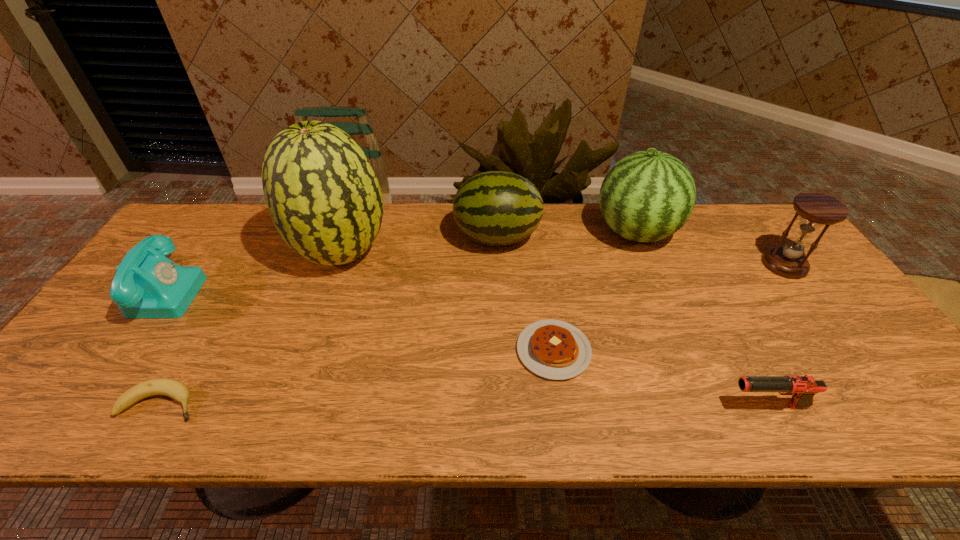
Where is `blank region between the second watermelon from left to right and the banana`? The width and height of the screenshot is (960, 540). blank region between the second watermelon from left to right and the banana is located at coordinates (329, 320).

This screenshot has height=540, width=960. Identify the location of the sixth closest object relative to the telephone. (802, 388).

Select which object appears as the closest to the pancake. Please provide its 2D coordinates. Your answer should be formatted as a tuple, i.e. [(x, y)], where the tuple contains the x and y coordinates of a point satisfying the conditions above.

[(496, 208)]

Where is `watermelon identified as the third closest to the banana`? The image size is (960, 540). watermelon identified as the third closest to the banana is located at coordinates (647, 196).

Select which watermelon appears as the second closest to the leftmost watermelon. Please provide its 2D coordinates. Your answer should be formatted as a tuple, i.e. [(x, y)], where the tuple contains the x and y coordinates of a point satisfying the conditions above.

[(647, 196)]

This screenshot has width=960, height=540. Find the location of `free spot that satisfies the following two spatial constraints: 1. on the dial of the fourth shortest object; 2. on the left side of the pancake`. free spot that satisfies the following two spatial constraints: 1. on the dial of the fourth shortest object; 2. on the left side of the pancake is located at coordinates (121, 350).